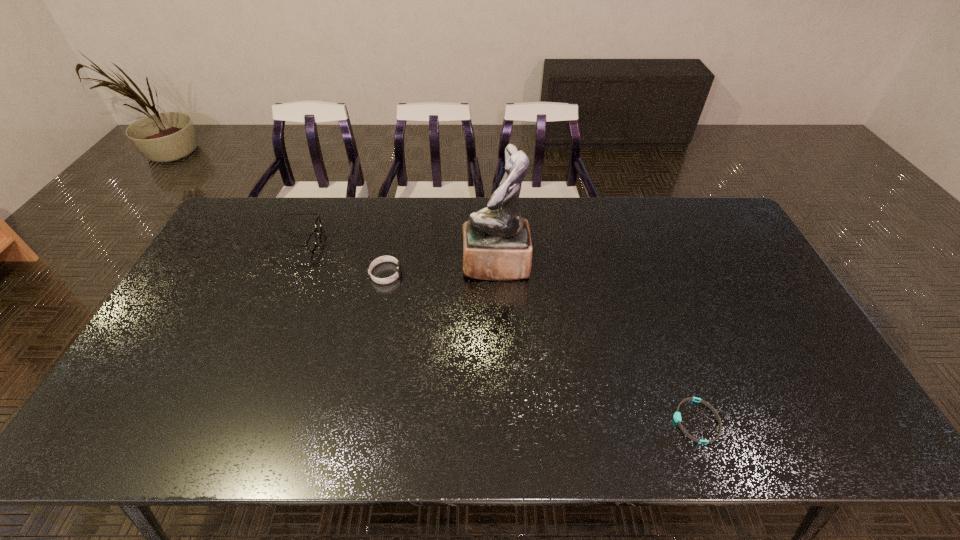
Locate an element on the screen. Image resolution: width=960 pixels, height=540 pixels. vacant space located in a relaxed pose on the second object from right to left is located at coordinates (397, 264).

Find the location of a particular element. free space located on the front-facing side of the spectacles is located at coordinates (395, 240).

At what (x,y) coordinates should I click in order to perform the action: click on blank space located 0.140m on the outer surface of the farther wristband. Please return your answer as a coordinate pair (x, y). Image resolution: width=960 pixels, height=540 pixels. Looking at the image, I should click on (445, 274).

The image size is (960, 540). Identify the location of free space located on the buckle of the nearest object. (614, 421).

Where is `vacant space situated on the buckle of the nearest object`? vacant space situated on the buckle of the nearest object is located at coordinates (504, 421).

What are the coordinates of `vacant space located on the buckle of the nearest object` in the screenshot? It's located at point(602,421).

Locate an element on the screen. object at the far edge is located at coordinates (311, 242).

Identify the location of object present at the near edge. The width and height of the screenshot is (960, 540). (677, 415).

Locate an element on the screen. free space at the far edge of the desktop is located at coordinates (338, 225).

Locate an element on the screen. vacant area at the near edge of the desktop is located at coordinates (329, 433).